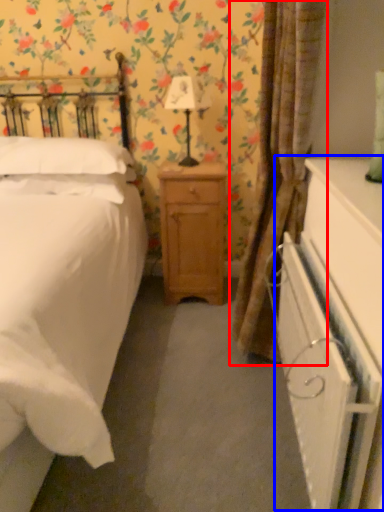
Question: Among these objects, which one is nearest to the camera, curtain (highlighted by a red box) or dresser (highlighted by a blue box)?

Choices:
 (A) curtain
 (B) dresser

Answer: (B)